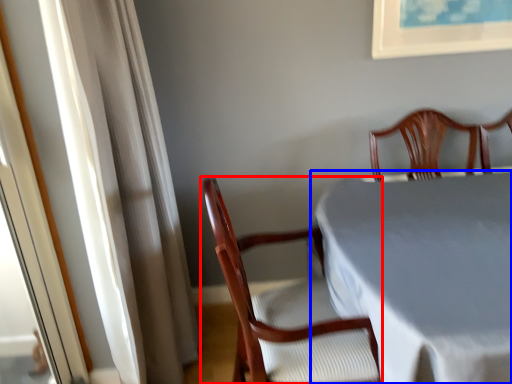
Question: Which object appears farthest to the camera in this image, chair (highlighted by a red box) or table (highlighted by a blue box)?

Choices:
 (A) chair
 (B) table

Answer: (A)